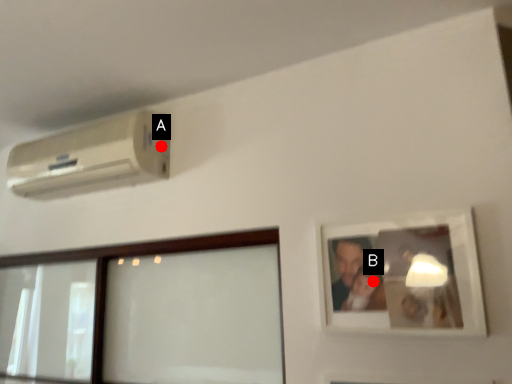
Question: Two points are circled on the image, labeled by A and B beside each circle. Which of the following is the closest to the observer?

Choices:
 (A) A is closer
 (B) B is closer

Answer: (B)